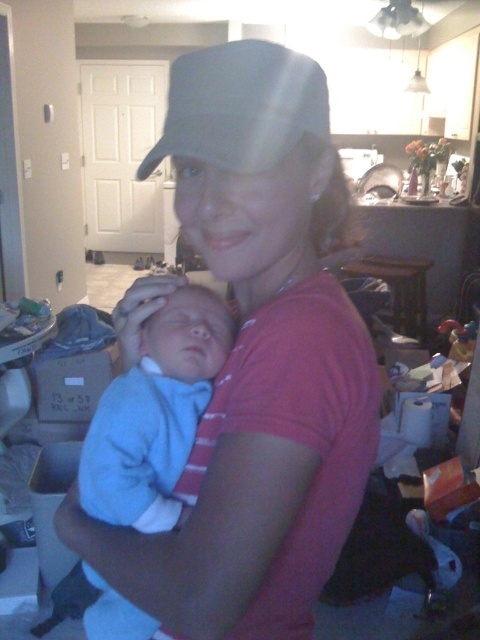
Question: Can you confirm if matte pink shirt at center is bigger than light blue soft fabric newborn at center?

Choices:
 (A) no
 (B) yes

Answer: (B)

Question: Does matte pink shirt at center appear on the right side of light blue soft fabric newborn at center?

Choices:
 (A) no
 (B) yes

Answer: (B)

Question: Which object is farther from the camera taking this photo?

Choices:
 (A) matte pink shirt at center
 (B) light blue soft fabric newborn at center

Answer: (B)

Question: Which point appears farthest from the camera in this image?

Choices:
 (A) (356, 326)
 (B) (276, 152)

Answer: (A)

Question: Among these objects, which one is nearest to the camera?

Choices:
 (A) matte pink shirt at center
 (B) light blue soft fabric newborn at center
 (C) gray fabric baseball cap at upper center

Answer: (A)

Question: Is matte pink shirt at center to the right of light blue soft fabric newborn at center from the viewer's perspective?

Choices:
 (A) yes
 (B) no

Answer: (A)